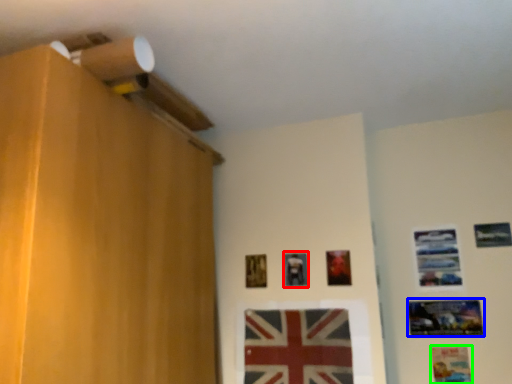
Question: Based on their relative distances, which object is farther from picture frame (highlighted by a red box)? Choose from picture frame (highlighted by a blue box) and picture frame (highlighted by a green box).

Choices:
 (A) picture frame
 (B) picture frame

Answer: (B)